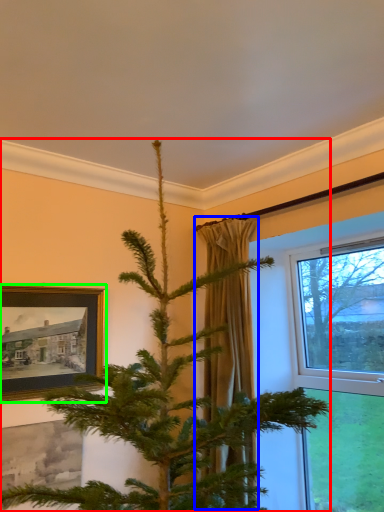
Question: Which is nearer to the christmas tree (highlighted by a red box)? curtain (highlighted by a blue box) or picture frame (highlighted by a green box).

Choices:
 (A) curtain
 (B) picture frame

Answer: (A)